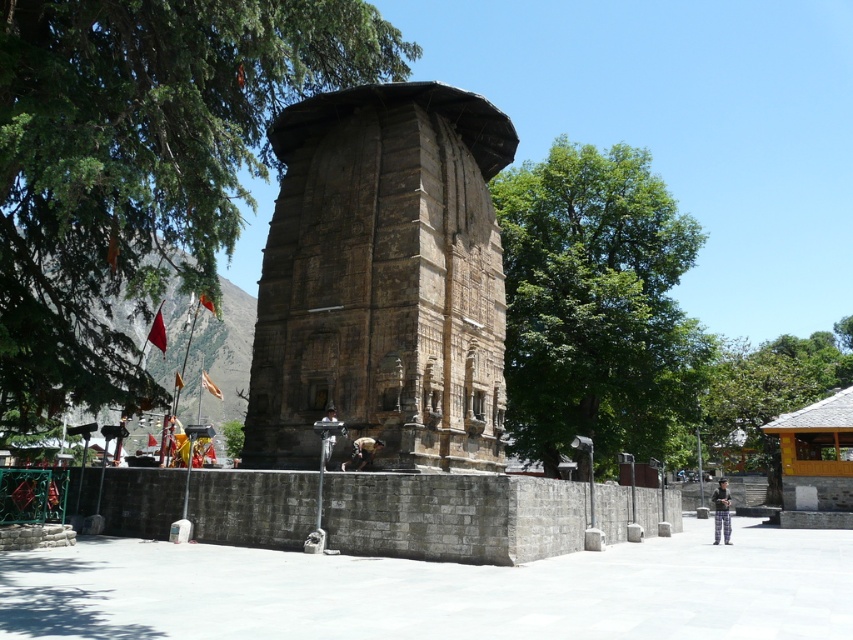
You are standing at the center of the courtyard in front of the historical stone structure. There is a point marked at coordinates (596, 305). What object is located at that point?

The point at coordinates (596, 305) marks the location of the green leafy tree at center.

You are standing in front of the historical stone structure and want to take a photo of the green leafy tree at center. Where should you position yourself to capture the tree in the center of your camera frame?

To capture the green leafy tree at center in the center of your camera frame, position yourself directly in front of the tree at the coordinates specified by its 2D location point at (596, 305).

In the scene shown: You are a visitor standing in front of the dark gray stone statue at center. You want to take a photo of the green leafy tree at upper left without any obstructions. Is there enough space between you and the tree to do so?

The green leafy tree at upper left is located above the dark gray stone statue at center, so if you are standing in front of the statue, the tree is positioned above it. This means there should be a clear line of sight to capture the tree without obstruction from the statue itself. However, ensure there are no other objects like the nearby metal poles or the low stone wall blocking your view.